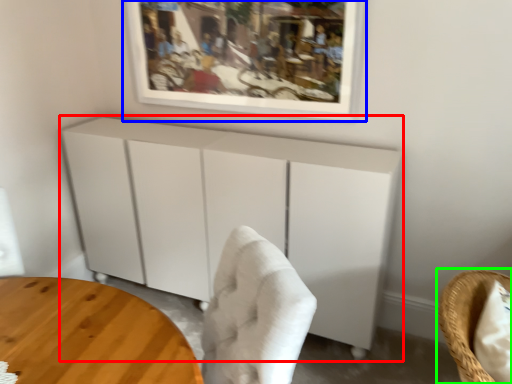
Question: Which is nearer to the cabinetry (highlighted by a red box)? picture frame (highlighted by a blue box) or chair (highlighted by a green box).

Choices:
 (A) picture frame
 (B) chair

Answer: (A)